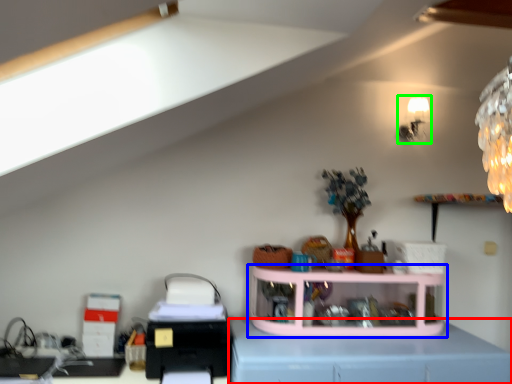
Question: Estimate the real-world distances between objects in this image. Which object is farther from computer desk (highlighted by a red box), shelf (highlighted by a blue box) or lamp (highlighted by a green box)?

Choices:
 (A) shelf
 (B) lamp

Answer: (B)